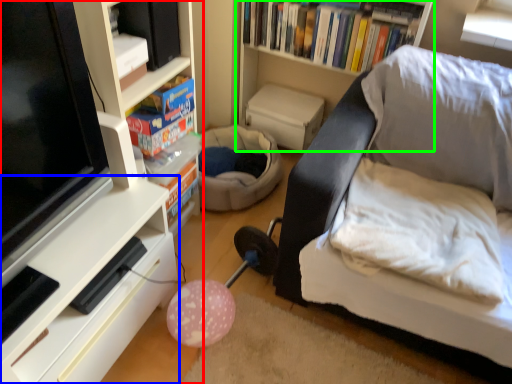
Question: Based on their relative distances, which object is farther from shelf (highlighted by a red box)? Choose from shelf (highlighted by a blue box) and bookshelf (highlighted by a green box).

Choices:
 (A) shelf
 (B) bookshelf

Answer: (B)